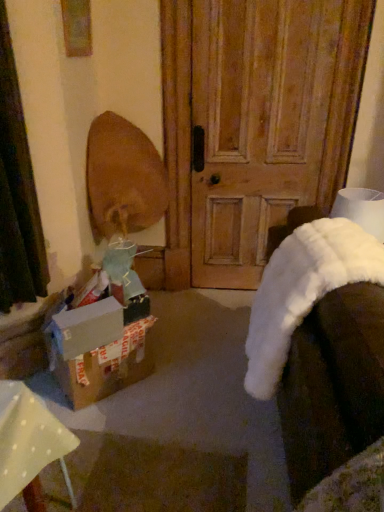
Question: Does cardboard box at lower left have a larger size compared to wooden door at center?

Choices:
 (A) yes
 (B) no

Answer: (B)

Question: Can you confirm if cardboard box at lower left is positioned to the right of wooden door at center?

Choices:
 (A) no
 (B) yes

Answer: (A)

Question: From a real-world perspective, is cardboard box at lower left on top of wooden door at center?

Choices:
 (A) no
 (B) yes

Answer: (A)

Question: Is cardboard box at lower left not inside wooden door at center?

Choices:
 (A) yes
 (B) no

Answer: (A)

Question: Considering the relative positions of cardboard box at lower left and wooden door at center in the image provided, is cardboard box at lower left behind wooden door at center?

Choices:
 (A) no
 (B) yes

Answer: (A)

Question: Looking at their shapes, would you say wooden door at center is wider or thinner than cardboard box at lower left?

Choices:
 (A) thin
 (B) wide

Answer: (B)

Question: Is wooden door at center inside or outside of cardboard box at lower left?

Choices:
 (A) inside
 (B) outside

Answer: (B)

Question: Is wooden door at center taller or shorter than cardboard box at lower left?

Choices:
 (A) tall
 (B) short

Answer: (A)

Question: From the image's perspective, is wooden door at center located above or below cardboard box at lower left?

Choices:
 (A) below
 (B) above

Answer: (B)

Question: Is cardboard box at lower left bigger or smaller than white fluffy blanket at lower right?

Choices:
 (A) small
 (B) big

Answer: (A)

Question: Relative to white fluffy blanket at lower right, is cardboard box at lower left in front or behind?

Choices:
 (A) behind
 (B) front

Answer: (A)

Question: In the image, is cardboard box at lower left on the left side or the right side of white fluffy blanket at lower right?

Choices:
 (A) left
 (B) right

Answer: (A)

Question: From a real-world perspective, relative to white fluffy blanket at lower right, is cardboard box at lower left vertically above or below?

Choices:
 (A) above
 (B) below

Answer: (B)

Question: Considering the positions of brown cardboard box at lower left and white fluffy blanket at lower right in the image, is brown cardboard box at lower left taller or shorter than white fluffy blanket at lower right?

Choices:
 (A) tall
 (B) short

Answer: (B)

Question: Is brown cardboard box at lower left inside the boundaries of white fluffy blanket at lower right, or outside?

Choices:
 (A) outside
 (B) inside

Answer: (A)